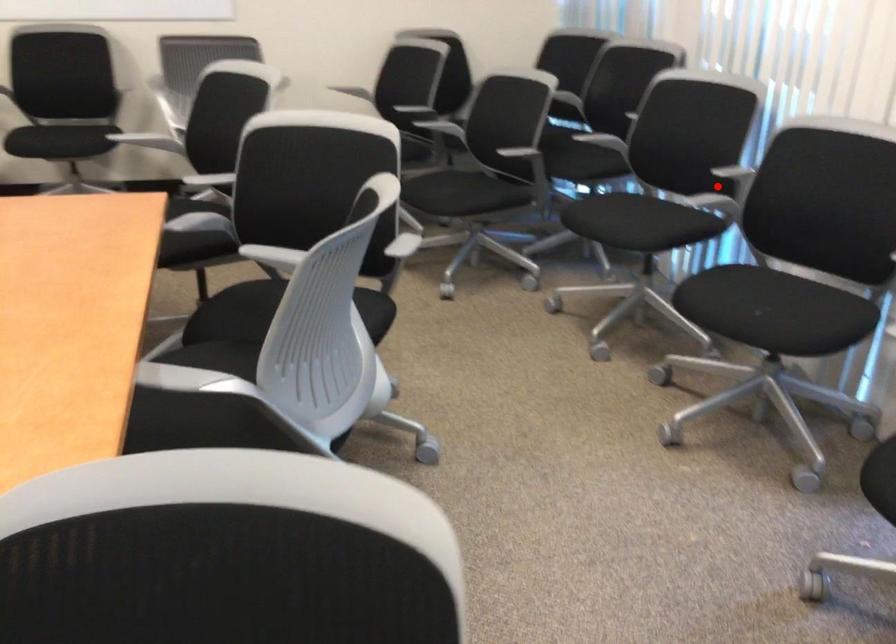
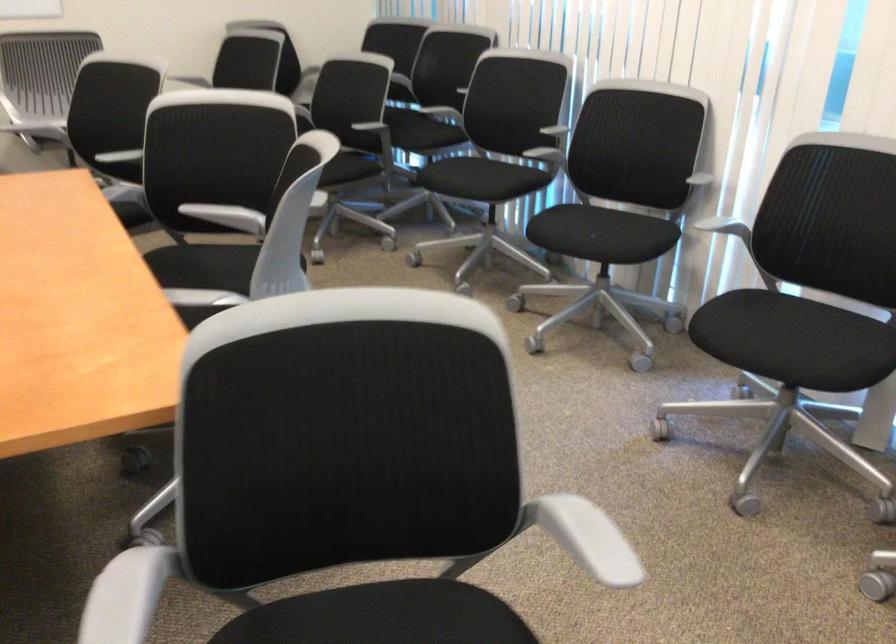
The point at the highlighted location is marked in the first image. Where is the corresponding point in the second image?

(543, 146)